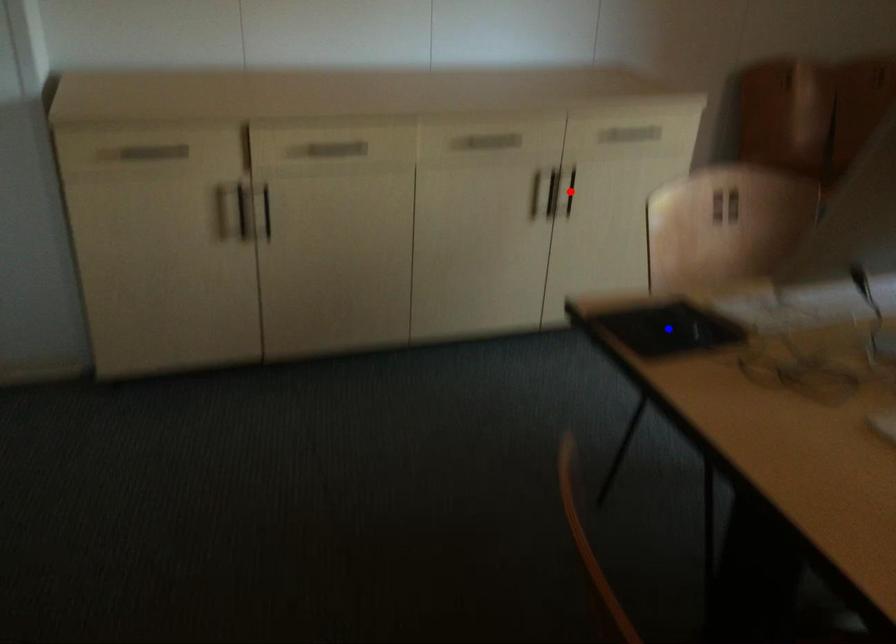
Question: Two points are marked on the image. Which point is closer to the camera?

Choices:
 (A) Blue point is closer.
 (B) Red point is closer.

Answer: (A)